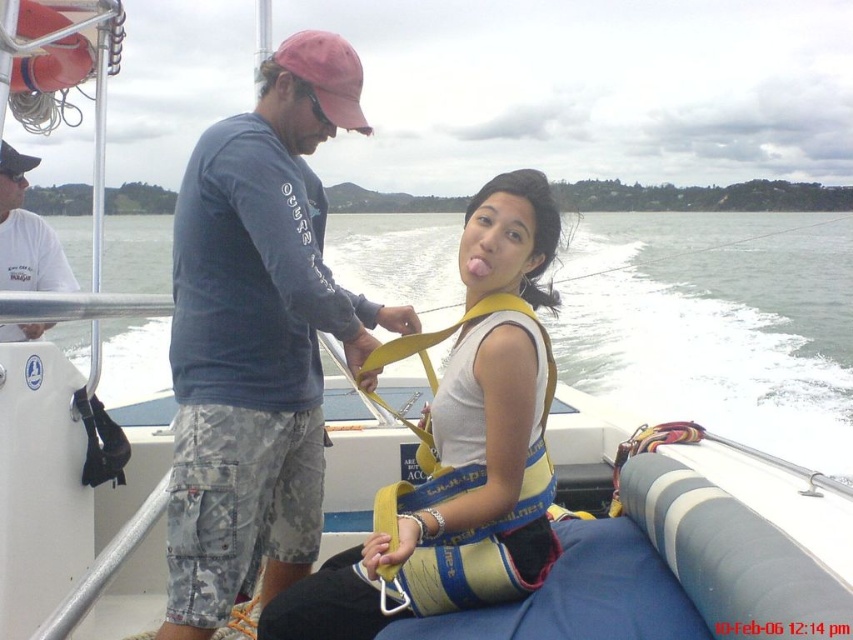
Question: Which point appears closest to the camera in this image?

Choices:
 (A) (717, 237)
 (B) (48, 81)
 (C) (531, 358)

Answer: (C)

Question: Among these objects, which one is farthest from the camera?

Choices:
 (A) camouflage shorts at center
 (B) white cotton shirt at upper left
 (C) orange rubber life jacket at upper left
 (D) yellow fabric life vest at center

Answer: (B)

Question: Which object is closer to the camera taking this photo?

Choices:
 (A) camouflage shorts at center
 (B) yellow life vest at center
 (C) white cotton shirt at upper left

Answer: (A)

Question: Is white cotton shirt at upper left closer to the viewer compared to orange rubber life jacket at upper left?

Choices:
 (A) yes
 (B) no

Answer: (B)

Question: Does white cotton shirt at upper left appear on the left side of orange rubber life jacket at upper left?

Choices:
 (A) yes
 (B) no

Answer: (A)

Question: Is yellow life vest at center to the right of yellow fabric life vest at center from the viewer's perspective?

Choices:
 (A) no
 (B) yes

Answer: (A)